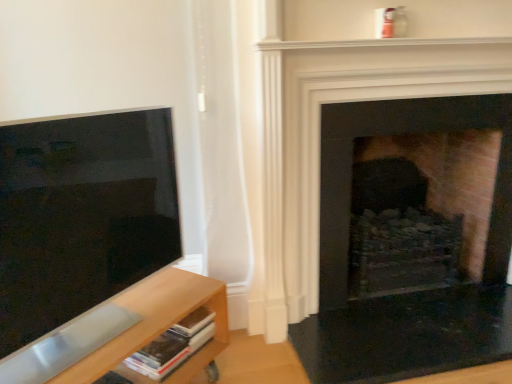
The height and width of the screenshot is (384, 512). Find the location of `free location in front of brick fireplace at right, positioned as the 1th fireplace in back-to-front order`. free location in front of brick fireplace at right, positioned as the 1th fireplace in back-to-front order is located at coordinates (418, 342).